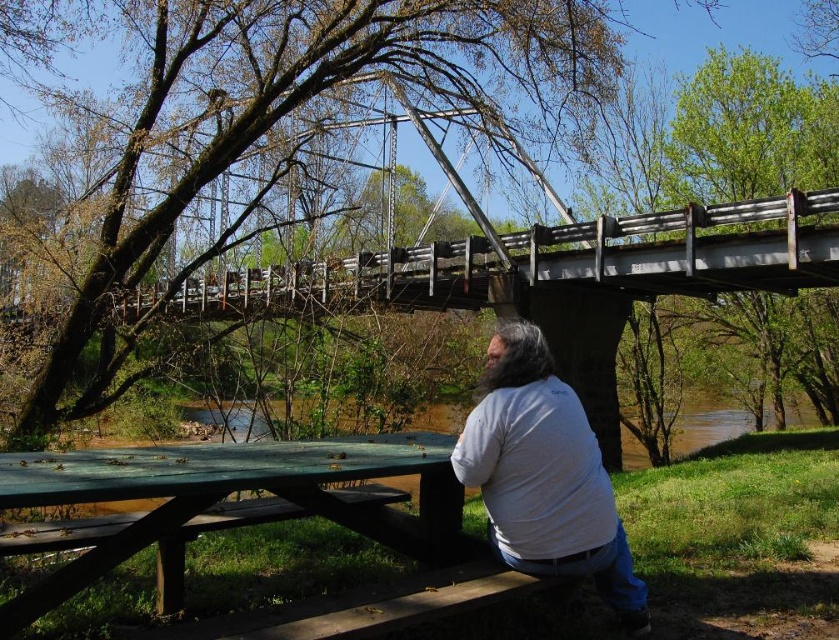
You are standing at the edge of the picnic area and want to place a small picnic basket between the white matte shirt at lower center and the wooden bench at lower center. Based on their positions, where should you place the basket?

The white matte shirt at lower center is to the right of the wooden bench at lower center, so you should place the basket to the right of the wooden bench at lower center but to the left of the white matte shirt at lower center to position it between them.

You are planning to place a small decorative item on the picnic table. Given the sizes of the green wood picnic table at lower center and the white matte shirt at lower center, which object would be more suitable to place the item on?

The green wood picnic table at lower center is larger in size than the white matte shirt at lower center, so the picnic table would be more suitable to place the small decorative item on.

You are standing at the bridge and want to reach the man sitting at the picnic table. The distance between you and the man is 2.29 meters. If you walk straight towards him, will you pass the white matte shirt at lower center before reaching him?

Yes, because the white matte shirt at lower center is between you and the man, so you will pass it before reaching him.